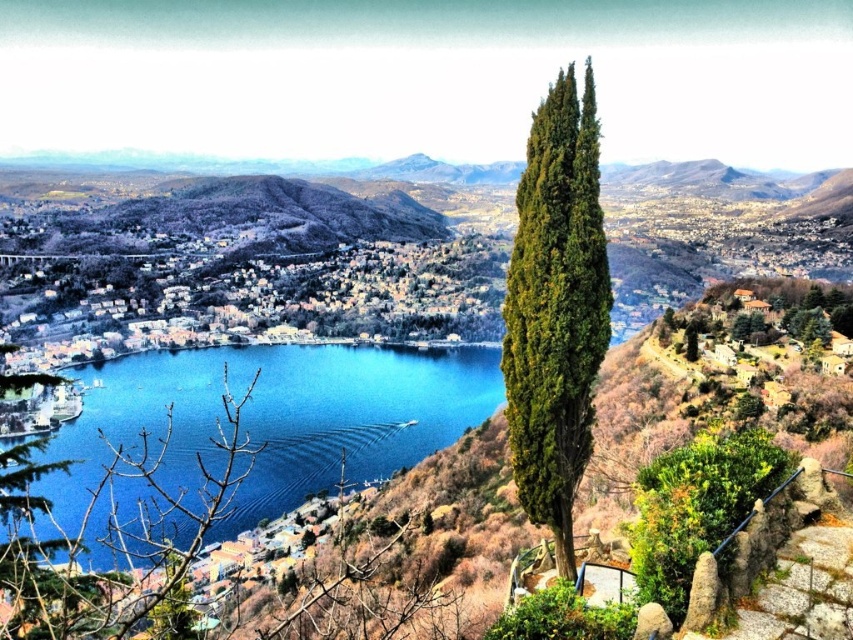
You are an artist sketching this landscape. You want to draw the green textured cypress at right and the green matte tree at lower left. Which tree should you sketch first if you follow a left to right drawing order?

You should sketch the green matte tree at lower left first because it is positioned to the left of the green textured cypress at right.

You are standing at the point with coordinates point (579, 269) and want to move towards the point (496, 352). Based on the scene, will you be moving closer to or farther away from the camera?

Since point (496, 352) is further to the camera than point (579, 269), moving from point (579, 269) towards point (496, 352) means you are moving closer to the camera.